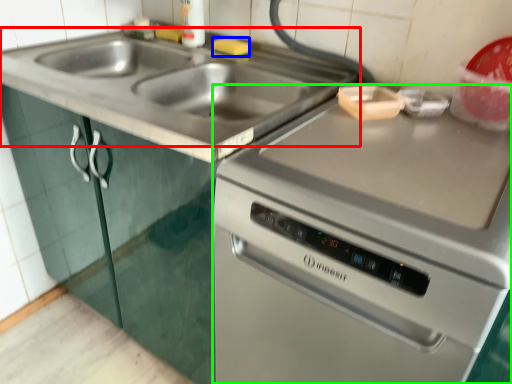
Question: Estimate the real-world distances between objects in this image. Which object is closer to sink (highlighted by a red box), food (highlighted by a blue box) or oven (highlighted by a green box)?

Choices:
 (A) food
 (B) oven

Answer: (A)